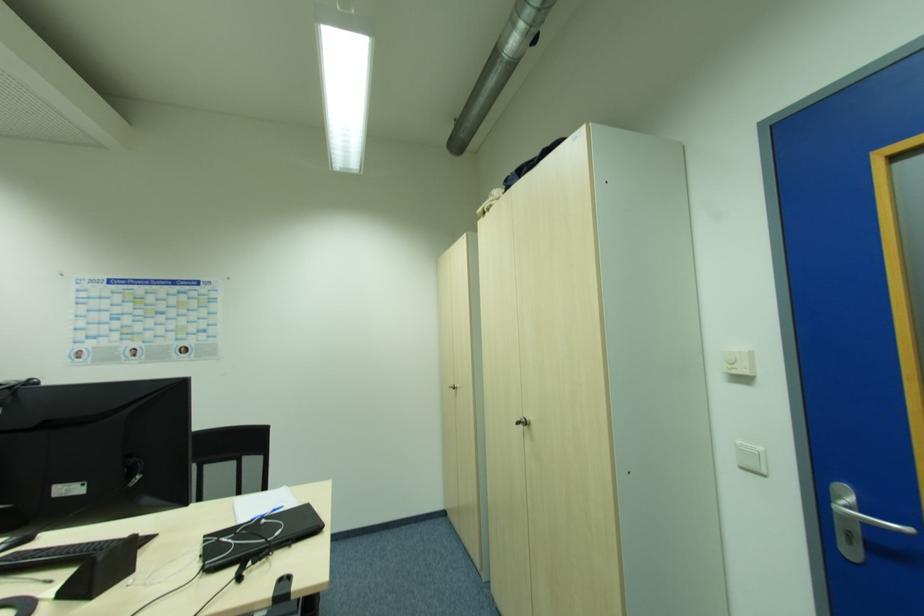
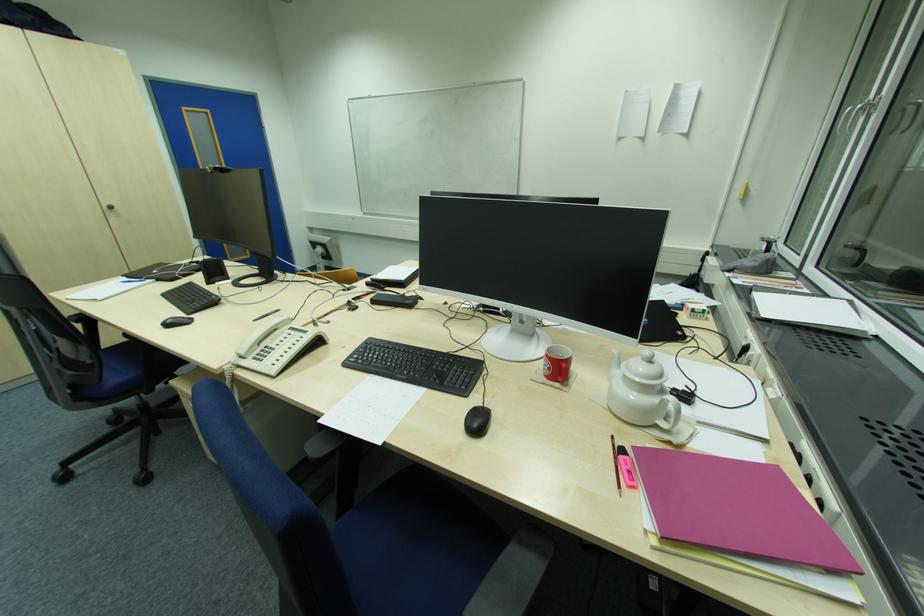
The point at (x=526, y=424) is marked in the first image. Where is the corresponding point in the second image?

(114, 209)